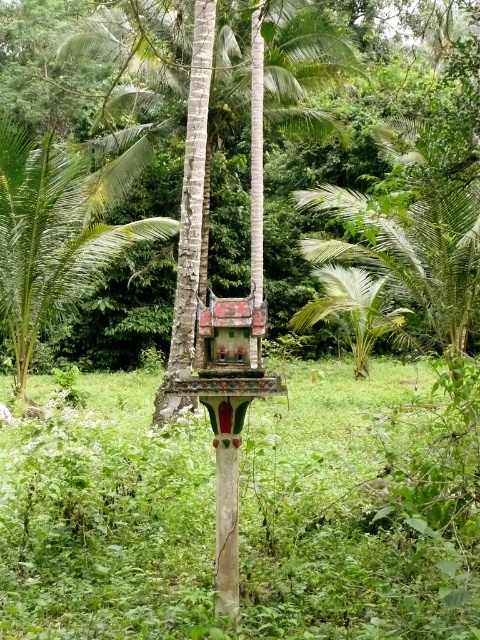
Question: Does painted wood bird feeder at center appear on the right side of green leafy palm tree at center?

Choices:
 (A) yes
 (B) no

Answer: (B)

Question: From the image, what is the correct spatial relationship of green leafy palm tree at left in relation to green leafy palm tree at center?

Choices:
 (A) above
 (B) below

Answer: (A)

Question: Which point is farther to the camera?

Choices:
 (A) (240, 422)
 (B) (92, 276)
 (C) (405, 333)

Answer: (B)

Question: Is painted wood bird feeder at center wider than green leafy palm tree at center?

Choices:
 (A) no
 (B) yes

Answer: (A)

Question: Which object is farther from the camera taking this photo?

Choices:
 (A) painted wood bird feeder at center
 (B) green leafy palm tree at left

Answer: (B)

Question: Which object is farther from the camera taking this photo?

Choices:
 (A) green leafy palm tree at left
 (B) painted wood bird feeder at center
 (C) green leafy palm tree at center

Answer: (C)